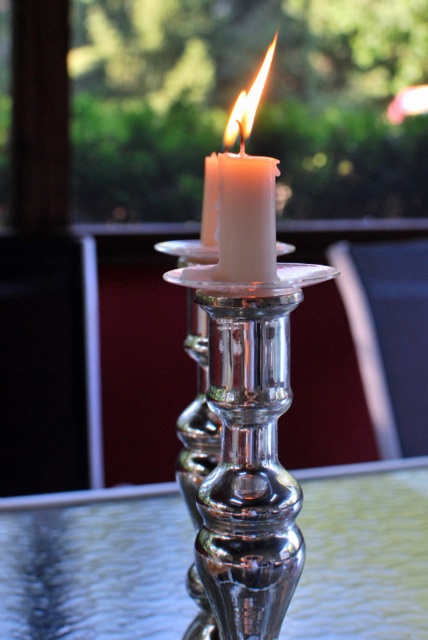
Between point (324, 570) and point (258, 83), which one is positioned behind?

Point (324, 570)

Does silver metallic table at center have a greater height compared to bright yellow flame at center?

Yes, silver metallic table at center is taller than bright yellow flame at center.

Find the location of a particular element. This screenshot has width=428, height=640. silver metallic table at center is located at coordinates (95, 570).

Does bright yellow flame at center appear on the right side of white wax candle at center?

Indeed, bright yellow flame at center is positioned on the right side of white wax candle at center.

Image resolution: width=428 pixels, height=640 pixels. What do you see at coordinates (247, 104) in the screenshot?
I see `bright yellow flame at center` at bounding box center [247, 104].

In order to click on bright yellow flame at center in this screenshot , I will do `click(247, 104)`.

Can you confirm if silver metallic table at center is positioned below white wax candle at center?

Yes, silver metallic table at center is below white wax candle at center.

Looking at this image, can you confirm if silver metallic table at center is bigger than white wax candle at center?

Indeed, silver metallic table at center has a larger size compared to white wax candle at center.

Measure the distance between silver metallic table at center and camera.

silver metallic table at center is 32.37 inches from camera.

You are a GUI agent. You are given a task and a screenshot of the screen. Output one action in this format:
    pyautogui.click(x=<x>, y=<y>)
    Task: Click on the silver metallic table at center
    The height and width of the screenshot is (640, 428).
    Given the screenshot: What is the action you would take?
    pyautogui.click(x=95, y=570)